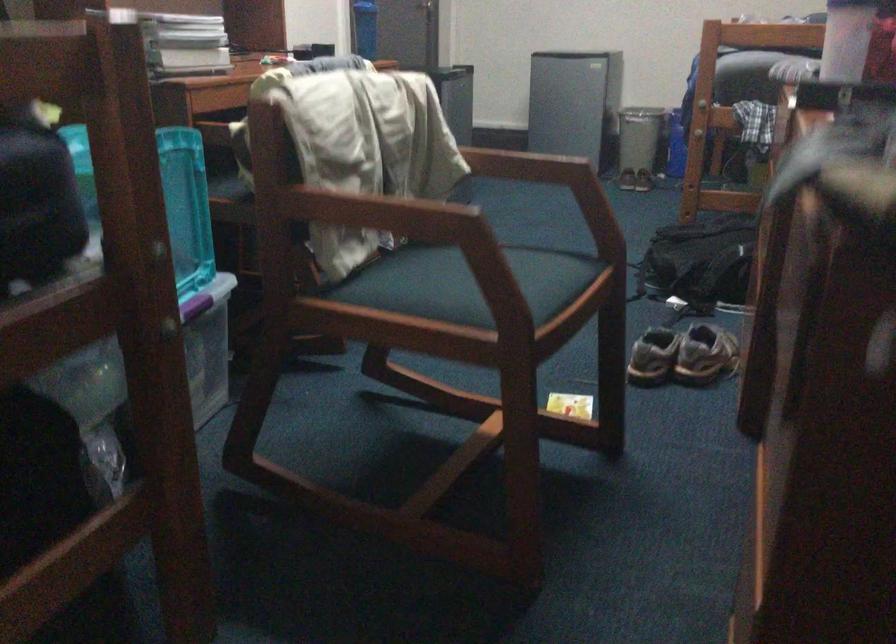
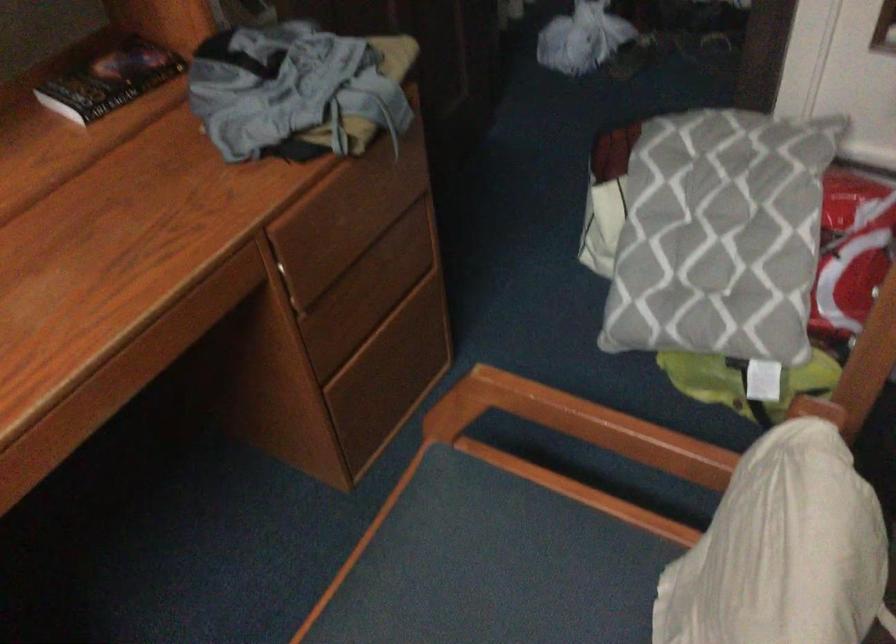
Where in the second image is the point corresponding to point (448, 232) from the first image?

(579, 424)